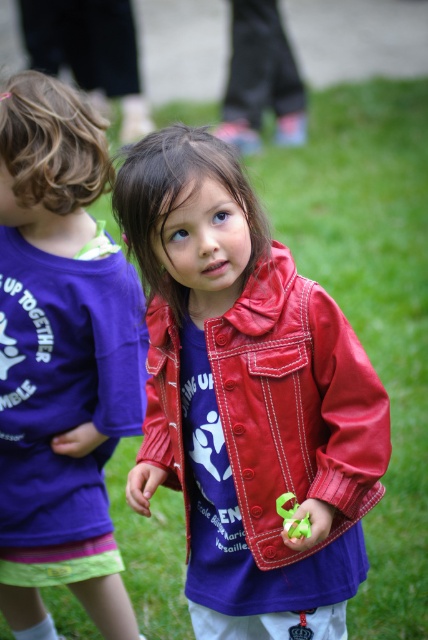
Who is positioned more to the left, shiny red jacket at center or purple cotton shirt at left?

Positioned to the left is purple cotton shirt at left.

Identify the location of shiny red jacket at center. (247, 397).

I want to click on shiny red jacket at center, so click(x=247, y=397).

Who is shorter, purple cotton shirt at left or green rubber toy at center?

With less height is green rubber toy at center.

Who is more distant from viewer, (50, 540) or (302, 524)?

Point (50, 540)

Between point (47, 296) and point (279, 502), which one is positioned behind?

The point (47, 296) is behind.

Locate an element on the screen. purple cotton shirt at left is located at coordinates (62, 358).

Between shiny red jacket at center and green rubber toy at center, which one appears on the left side from the viewer's perspective?

From the viewer's perspective, shiny red jacket at center appears more on the left side.

Is shiny red jacket at center wider than green rubber toy at center?

Indeed, shiny red jacket at center has a greater width compared to green rubber toy at center.

Is point (225, 273) positioned in front of point (294, 502)?

No, (225, 273) is further to viewer.

This screenshot has width=428, height=640. What are the coordinates of `shiny red jacket at center` in the screenshot? It's located at (247, 397).